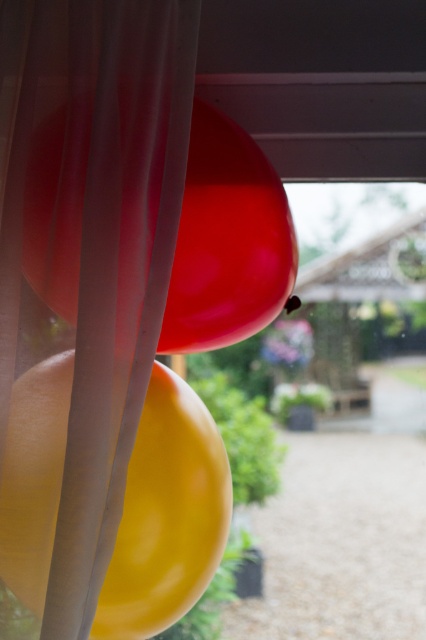
You are holding a helium tank and need to inflate the balloons shown in the image. The glossy yellow balloon at center and the glossy rubber balloon at center are both partially inflated. Which balloon requires more helium to reach the same size as the other?

The glossy rubber balloon at center requires more helium because it is larger than the glossy yellow balloon at center.

You are holding a camera and want to take a photo of the glossy yellow balloon at center and the glossy rubber balloon at center. Which balloon will appear more in focus in the photo?

The glossy yellow balloon at center will appear more in focus because it is closer to the viewer than the glossy rubber balloon at center.